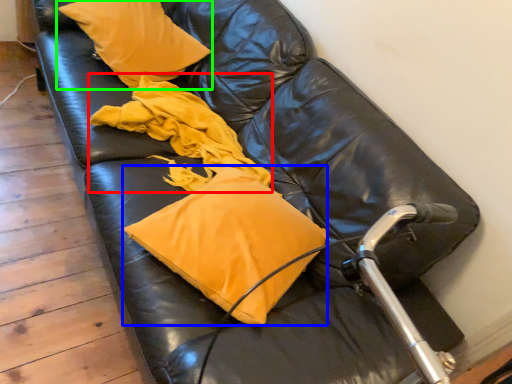
Question: Based on their relative distances, which object is farther from material (highlighted by a red box)? Choose from pillow (highlighted by a blue box) and pillow (highlighted by a green box).

Choices:
 (A) pillow
 (B) pillow

Answer: (A)